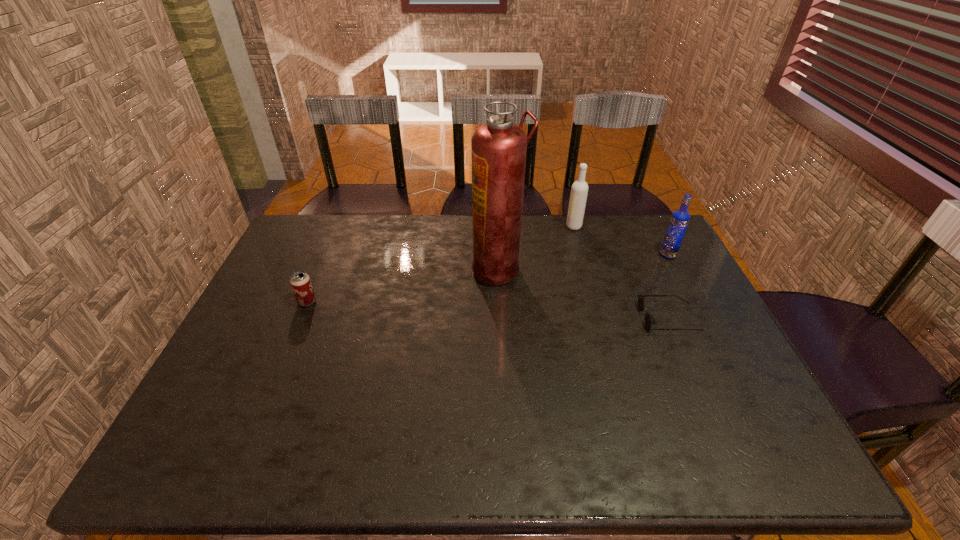
Where is `the tallest object`? Image resolution: width=960 pixels, height=540 pixels. the tallest object is located at coordinates (499, 148).

What are the coordinates of `the second object from left to right` in the screenshot? It's located at (499, 148).

Where is `the farthest object`? the farthest object is located at coordinates (579, 190).

Image resolution: width=960 pixels, height=540 pixels. What are the coordinates of `the farther vodka` in the screenshot? It's located at (579, 190).

I want to click on the right vodka, so click(x=680, y=218).

This screenshot has height=540, width=960. Identify the location of the leftmost object. (300, 282).

You are a GUI agent. You are given a task and a screenshot of the screen. Output one action in this format:
    pyautogui.click(x=<x>, y=<y>)
    Task: Click on the beer can
    
    Given the screenshot: What is the action you would take?
    pyautogui.click(x=300, y=282)

Find the location of a particular element. This screenshot has height=540, width=960. the shortest object is located at coordinates (649, 319).

At what (x,y) coordinates should I click in order to perform the action: click on blank area located 0.070m on the side of the fire extinguisher with the label. Please return your answer as a coordinate pair (x, y). Looking at the image, I should click on (450, 269).

Where is `vacant area situated on the side of the fire extinguisher with the label`? Image resolution: width=960 pixels, height=540 pixels. vacant area situated on the side of the fire extinguisher with the label is located at coordinates (387, 269).